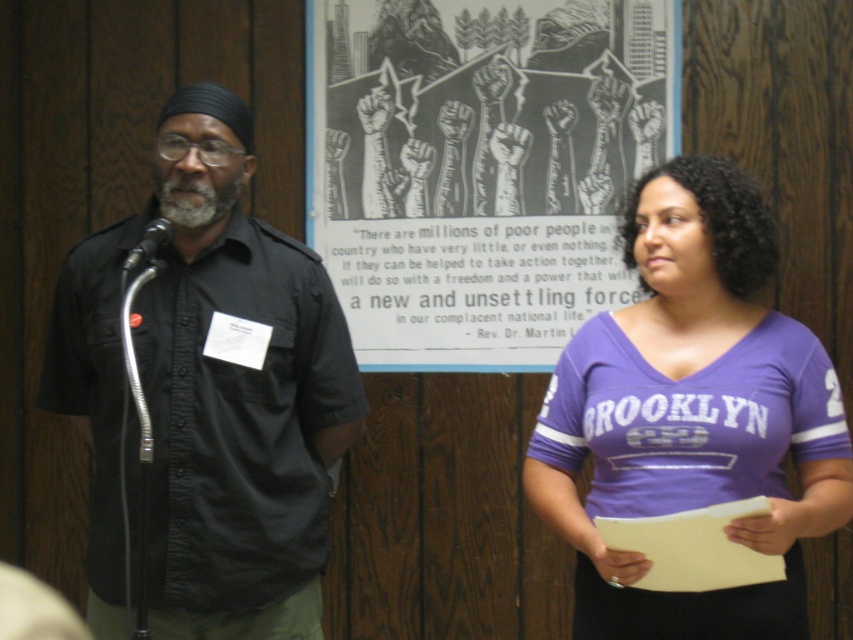
Question: Among these objects, which one is nearest to the camera?

Choices:
 (A) black metallic microphone at left
 (B) purple jersey at center
 (C) black matte shirt at center

Answer: (B)

Question: Which of these objects is positioned farthest from the black metallic microphone at left?

Choices:
 (A) black and white print at center
 (B) black matte shirt at center

Answer: (A)

Question: Which point is closer to the camera?

Choices:
 (A) black metallic microphone at left
 (B) black and white print at center
 (C) purple jersey at center
 (D) black matte shirt at center

Answer: (C)

Question: Is black matte shirt at center thinner than black metallic microphone at left?

Choices:
 (A) no
 (B) yes

Answer: (A)

Question: Where is black matte shirt at center located in relation to black metallic microphone at left in the image?

Choices:
 (A) below
 (B) above

Answer: (A)

Question: Can you confirm if purple jersey at center is positioned to the left of black metallic microphone at left?

Choices:
 (A) yes
 (B) no

Answer: (B)